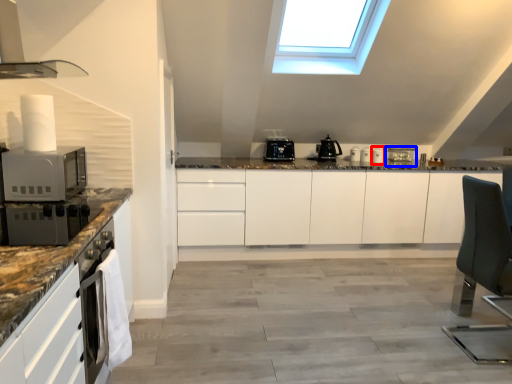
Question: Among these objects, which one is farthest to the camera, appliance (highlighted by a red box) or appliance (highlighted by a blue box)?

Choices:
 (A) appliance
 (B) appliance

Answer: (B)